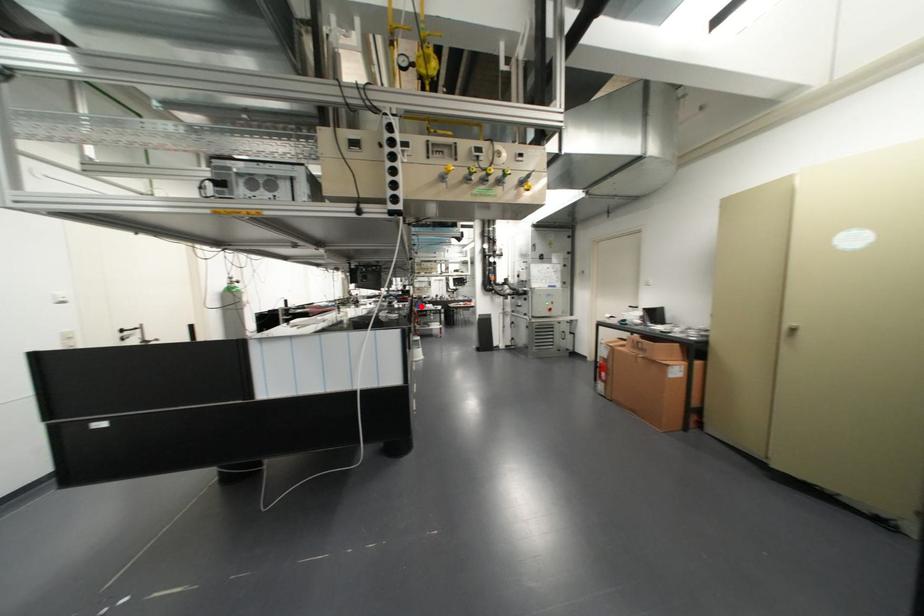
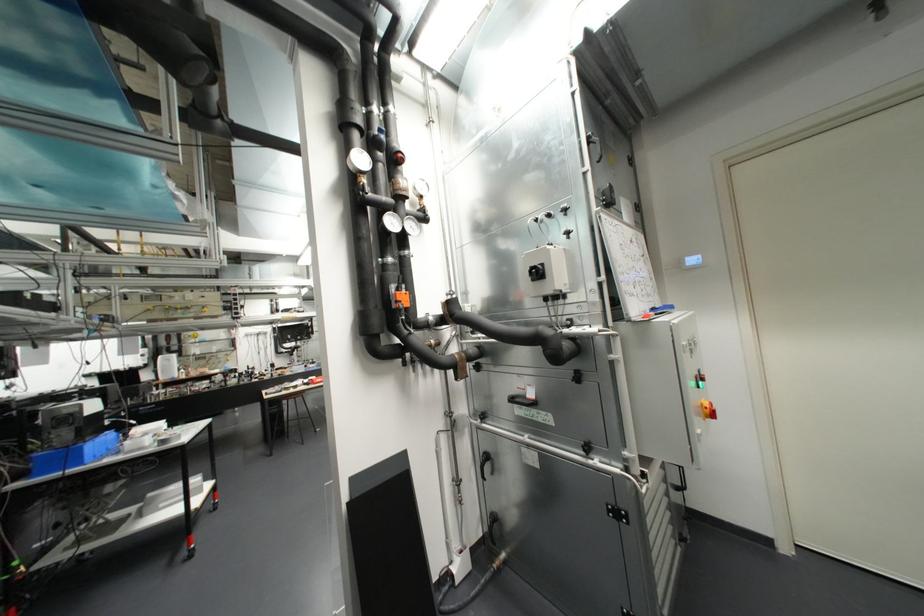
Where in the second image is the point corresponding to the highlighted location from the first image?

(71, 459)